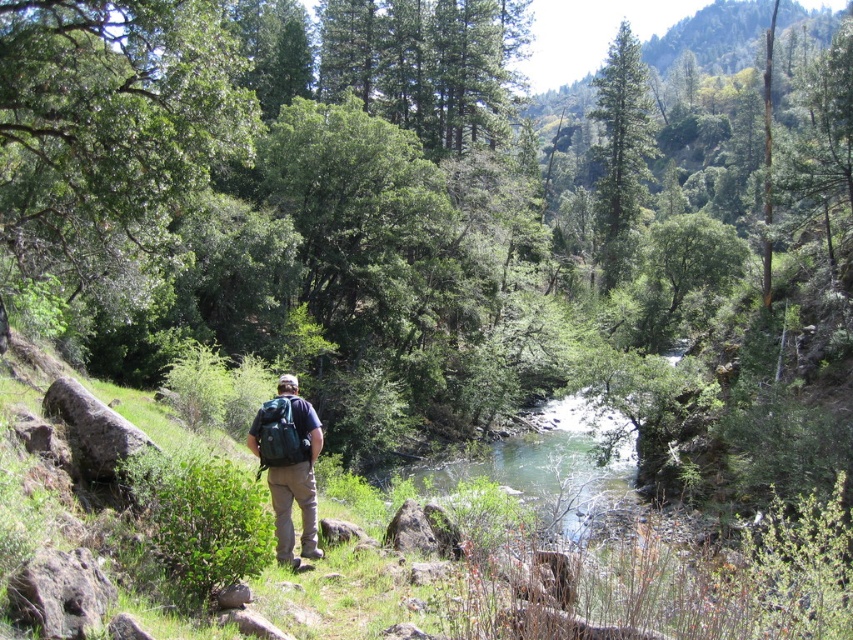
Is green textured pine tree at upper center in front of teal fabric backpack at center?

No.

Can you confirm if green textured pine tree at upper center is wider than teal fabric backpack at center?

Indeed, green textured pine tree at upper center has a greater width compared to teal fabric backpack at center.

Does point (621, 108) come farther from viewer compared to point (309, 410)?

That is True.

Where is `green textured pine tree at upper center`? The height and width of the screenshot is (640, 853). green textured pine tree at upper center is located at coordinates (619, 154).